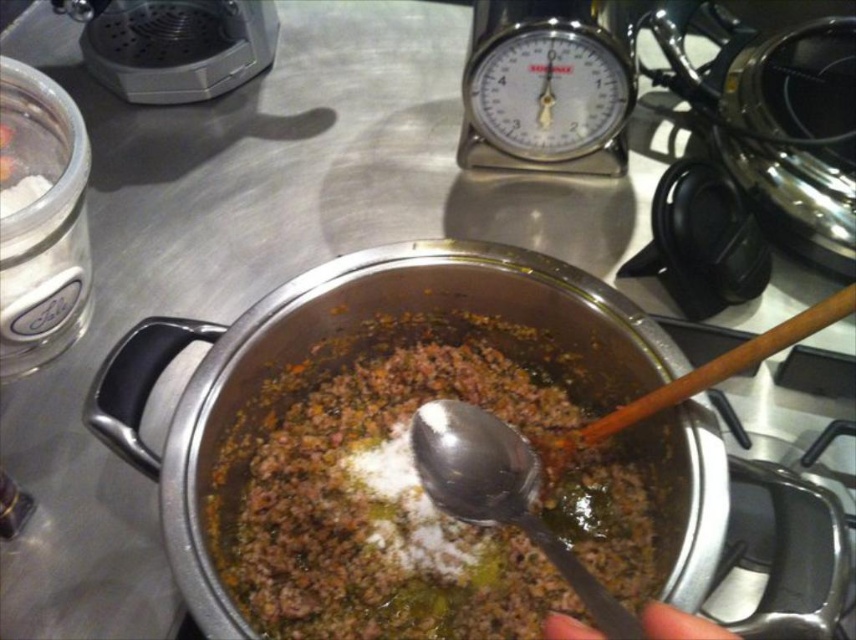
You are a GUI agent. You are given a task and a screenshot of the screen. Output one action in this format:
    pyautogui.click(x=<x>, y=<y>)
    Task: Click on the brown matte ground meat at center
    
    Given the screenshot: What is the action you would take?
    pyautogui.click(x=384, y=486)

Can you confirm if brown matte ground meat at center is positioned below silver metallic spoon at center?

Actually, brown matte ground meat at center is above silver metallic spoon at center.

Between point (339, 380) and point (450, 449), which one is positioned in front?

Point (450, 449) is in front.

Where is `brown matte ground meat at center`? This screenshot has width=856, height=640. brown matte ground meat at center is located at coordinates (384, 486).